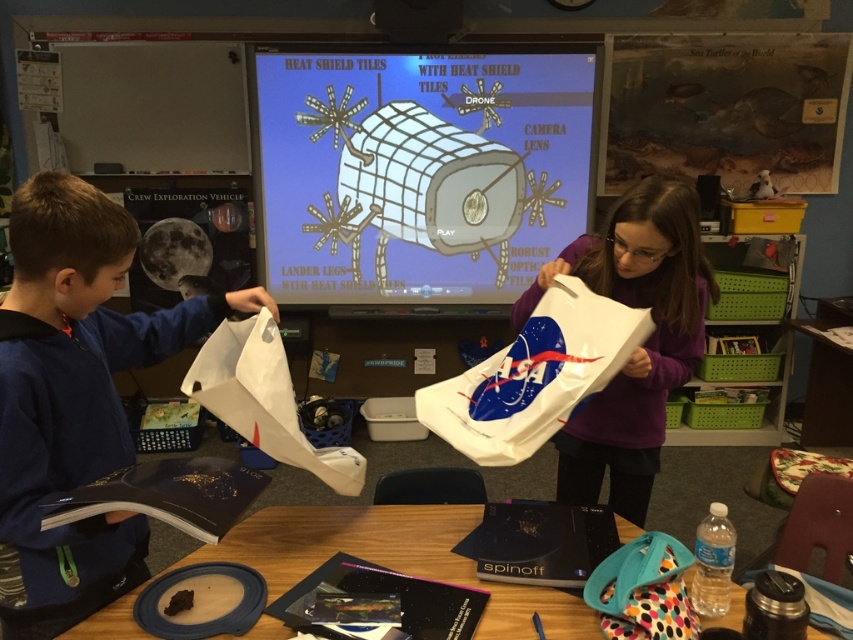
You are a student in the classroom and need to locate the white glossy screen at upper center. Based on the scene description, where would you find it relative to the wooden table?

The white glossy screen at upper center is located at point (419,172), which is above and to the left of the wooden table in the foreground.

You are a student in the classroom and need to locate the white glossy screen at upper center. Based on the scene description, where would you find it relative to the wooden table?

The white glossy screen at upper center is located at point coordinates [419,172], which places it above and to the left of the wooden table in the classroom.